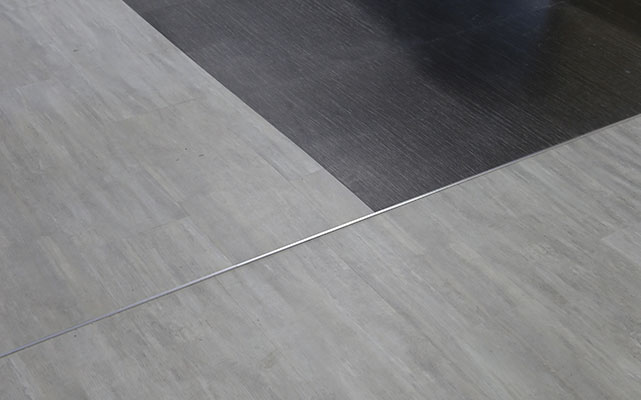
Where is `light gray area in gray flooring`? This screenshot has height=400, width=641. light gray area in gray flooring is located at coordinates (401, 365).